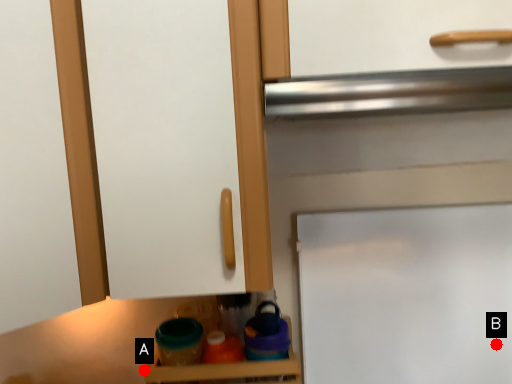
Question: Two points are circled on the image, labeled by A and B beside each circle. Which point is farther from the camera taking this photo?

Choices:
 (A) A is further
 (B) B is further

Answer: (A)